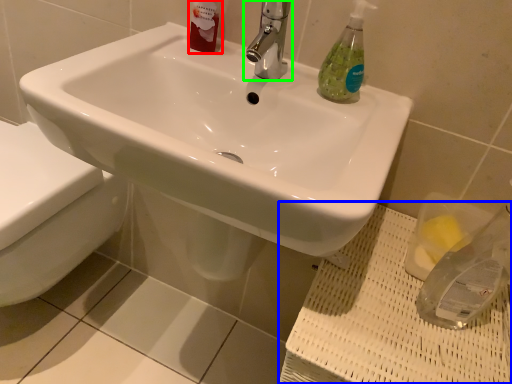
Question: Which is farther away from toiletry (highlighted by a red box)? porcelain (highlighted by a blue box) or tap (highlighted by a green box)?

Choices:
 (A) porcelain
 (B) tap

Answer: (A)